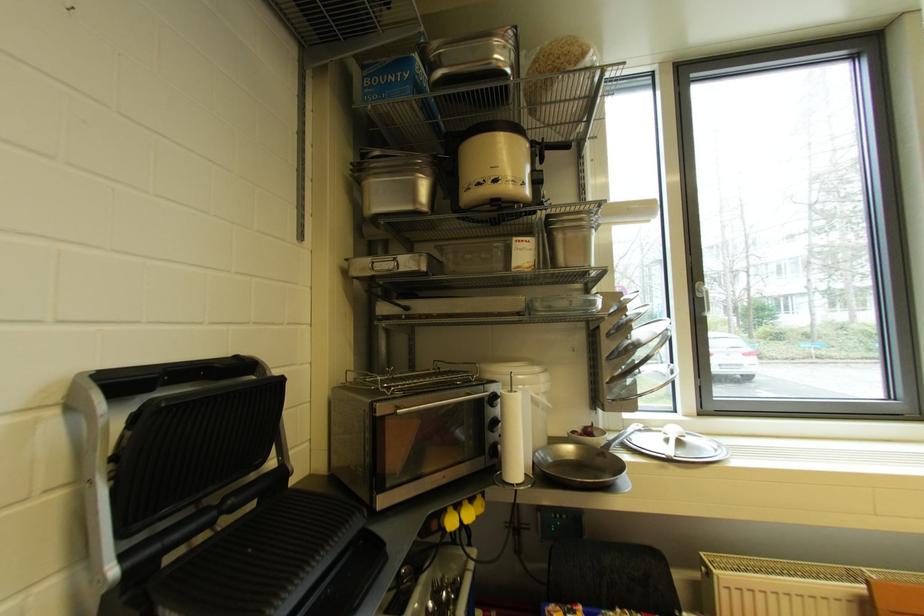
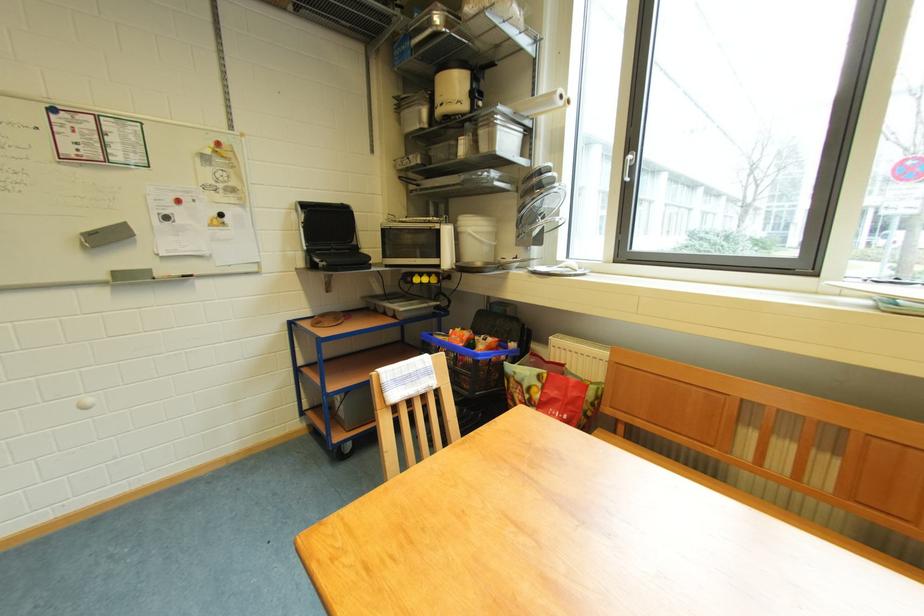
In the second image, find the point that corresponds to the point at 385,416 in the first image.

(390, 230)